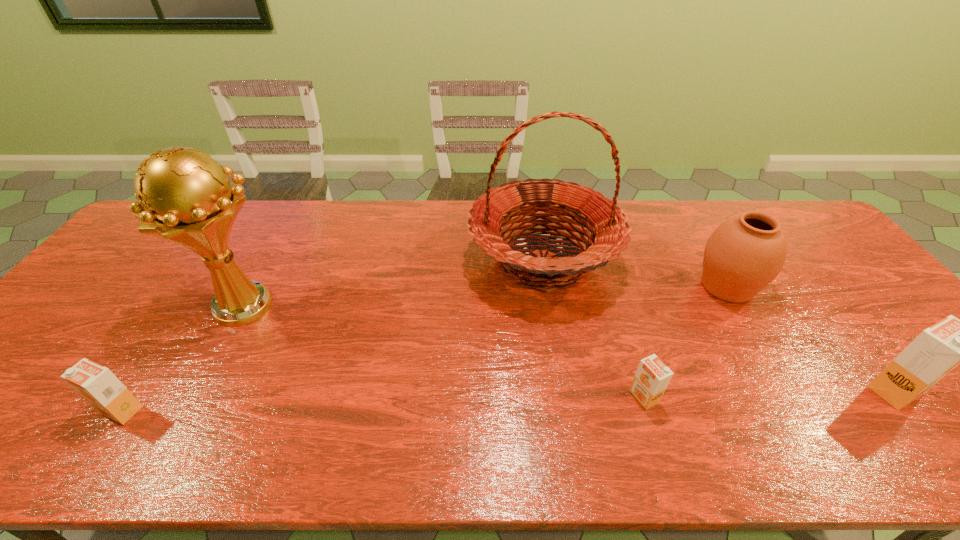
Where is `vacant space at the left edge`? vacant space at the left edge is located at coordinates (77, 363).

Where is `vacant point at the far right corner`? The image size is (960, 540). vacant point at the far right corner is located at coordinates (809, 225).

In order to click on free space that is in between the urn and the second shortest orange juice in this screenshot , I will do `click(424, 348)`.

Find the location of a particular element. This screenshot has height=540, width=960. vacant area that lies between the urn and the basket is located at coordinates (635, 273).

Find the location of a particular element. vacant point located between the rightmost object and the trophy_cup is located at coordinates (570, 348).

The height and width of the screenshot is (540, 960). What are the coordinates of `free space between the rightmost object and the second object from right to left` in the screenshot? It's located at (811, 338).

I want to click on free space between the basket and the shortest object, so click(593, 328).

You are a GUI agent. You are given a task and a screenshot of the screen. Output one action in this format:
    pyautogui.click(x=<x>, y=<y>)
    Task: Click on the vacant space in between the trophy_cup and the basket
    
    Given the screenshot: What is the action you would take?
    [x=395, y=283]

Identify the location of vacant space that is in between the urn and the basket. (635, 273).

Locate an element on the screen. This screenshot has width=960, height=540. free point between the second shortest orange juice and the shortest object is located at coordinates (383, 403).